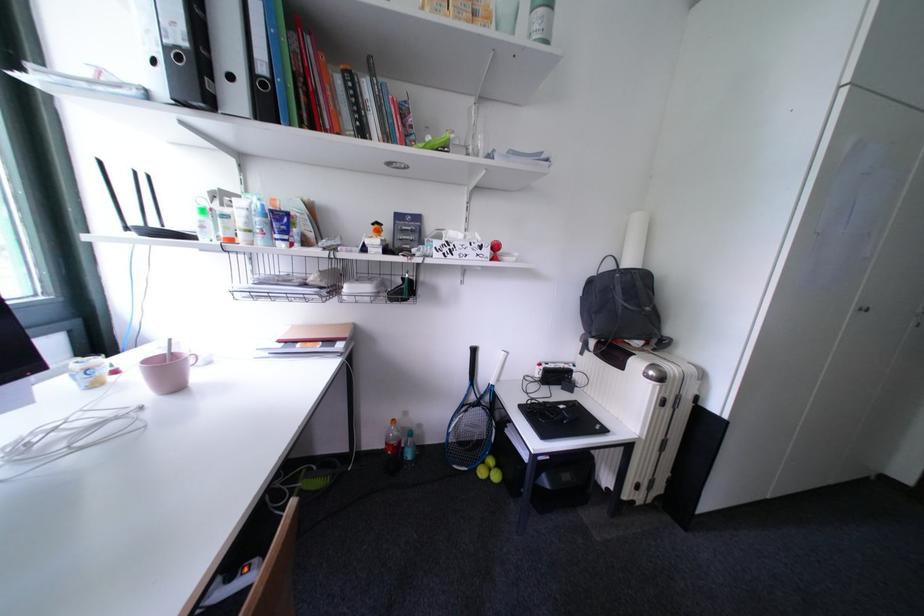
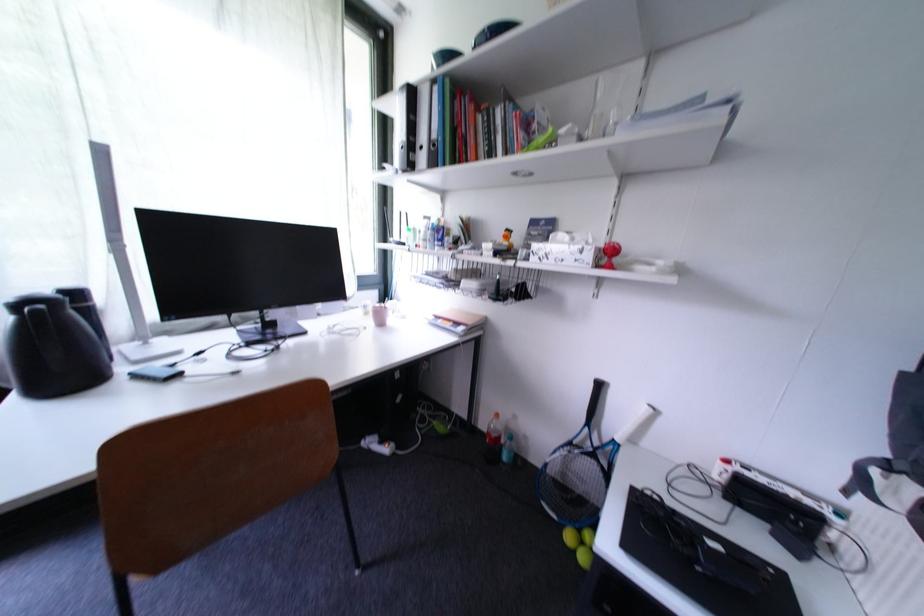
Question: The first image is from the beginning of the video and the second image is from the end. How did the camera likely rotate when shooting the video?

Choices:
 (A) Left
 (B) Right
 (C) Up
 (D) Down

Answer: (A)